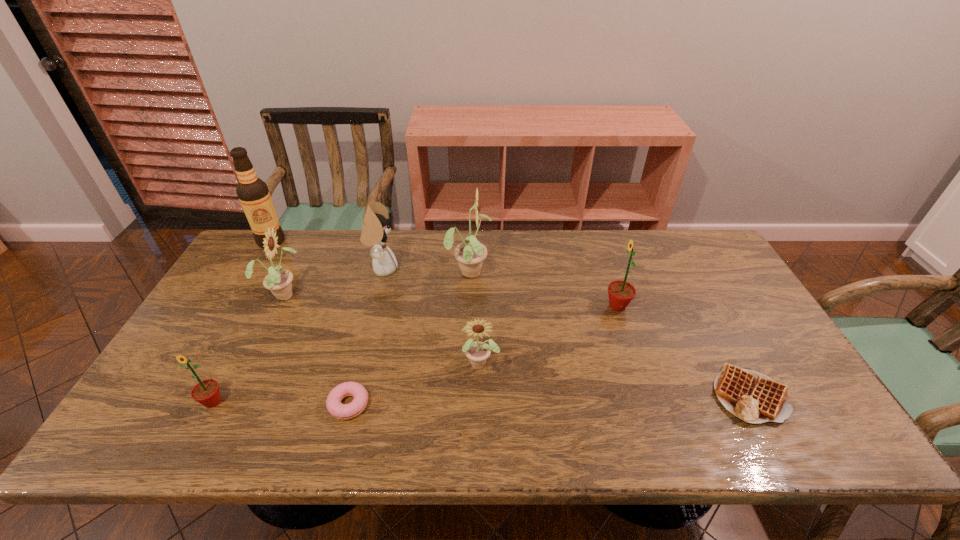
Image resolution: width=960 pixels, height=540 pixels. What are the coordinates of `vacant space located 0.090m on the front-facing side of the smallest yellow sunflower` in the screenshot? It's located at click(481, 408).

The width and height of the screenshot is (960, 540). Find the location of `vacant region located on the face of the nearer green sunflower`. vacant region located on the face of the nearer green sunflower is located at coordinates (195, 437).

The width and height of the screenshot is (960, 540). In order to click on free location located on the left of the rightmost object in this screenshot , I will do `click(577, 394)`.

Where is `blank space located 0.160m on the left of the doughnut`? blank space located 0.160m on the left of the doughnut is located at coordinates (260, 404).

Locate an element on the screen. alcohol at the far edge is located at coordinates (253, 193).

At what (x,y) coordinates should I click in order to perform the action: click on sunflower situated at the far edge. Please return your answer as a coordinate pair (x, y). Looking at the image, I should click on (470, 254).

What are the coordinates of `doll located at the far edge` in the screenshot? It's located at (376, 225).

This screenshot has height=540, width=960. I want to click on waffle that is at the near edge, so click(753, 397).

Identify the location of doughnut situated at the near edge. This screenshot has height=540, width=960. (334, 406).

Locate an element on the screen. This screenshot has height=540, width=960. alcohol located at the left edge is located at coordinates (253, 193).